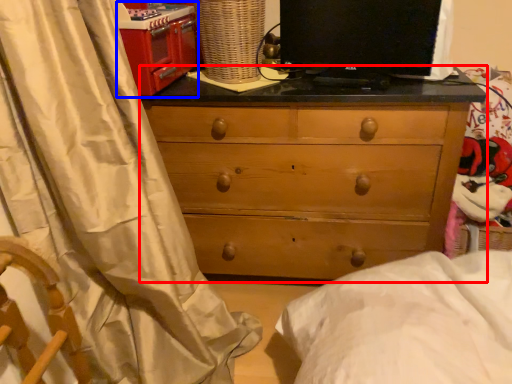
Question: Which point is closer to the camera, chest of drawers (highlighted by a red box) or appliance (highlighted by a blue box)?

Choices:
 (A) chest of drawers
 (B) appliance

Answer: (B)